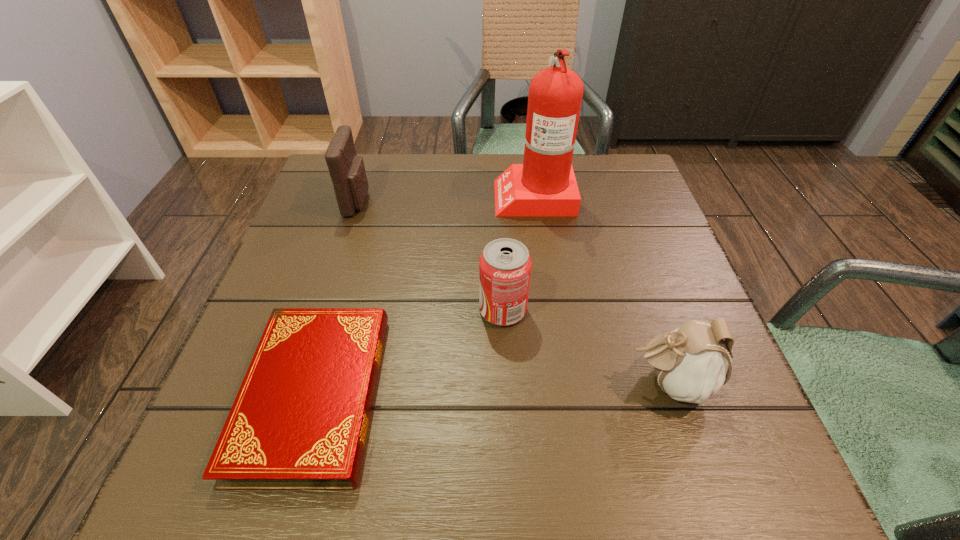
The width and height of the screenshot is (960, 540). What are the coordinates of `object that ranks as the closest to the soda can` in the screenshot? It's located at (692, 362).

Where is `vacant space that satisfies the following two spatial constraints: 1. with an open flap on the soda can; 2. on the left side of the farther pouch`? vacant space that satisfies the following two spatial constraints: 1. with an open flap on the soda can; 2. on the left side of the farther pouch is located at coordinates (324, 310).

The height and width of the screenshot is (540, 960). I want to click on vacant region that satisfies the following two spatial constraints: 1. on the back side of the soda can; 2. with an open flap on the left pouch, so click(498, 201).

This screenshot has height=540, width=960. Identify the location of vacant space that satisfies the following two spatial constraints: 1. on the back side of the soda can; 2. with an open flap on the left pouch. (498, 201).

Where is `free space in the image that satisfies the following two spatial constraints: 1. on the front-facing side of the right pouch; 2. on the cover of the shortest object`? Image resolution: width=960 pixels, height=540 pixels. free space in the image that satisfies the following two spatial constraints: 1. on the front-facing side of the right pouch; 2. on the cover of the shortest object is located at coordinates (672, 394).

The image size is (960, 540). Find the location of `vacant region that satisfies the following two spatial constraints: 1. on the front-facing side of the fire extinguisher; 2. on the cover of the hardback book`. vacant region that satisfies the following two spatial constraints: 1. on the front-facing side of the fire extinguisher; 2. on the cover of the hardback book is located at coordinates (563, 394).

At what (x,y) coordinates should I click in order to perform the action: click on vacant point that satisfies the following two spatial constraints: 1. on the front-facing side of the fire extinguisher; 2. on the cover of the shortest object. Please return your answer as a coordinate pair (x, y). The image size is (960, 540). Looking at the image, I should click on (563, 394).